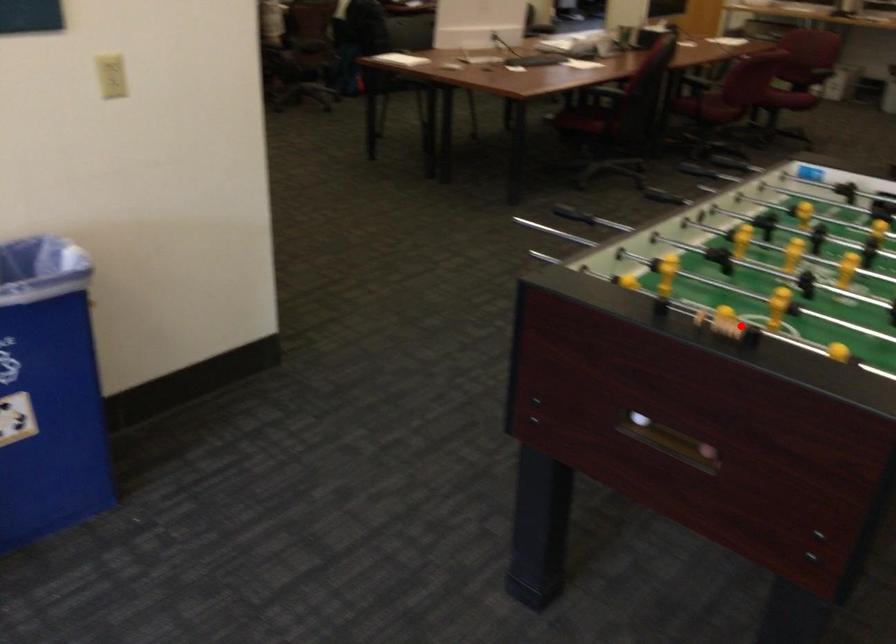
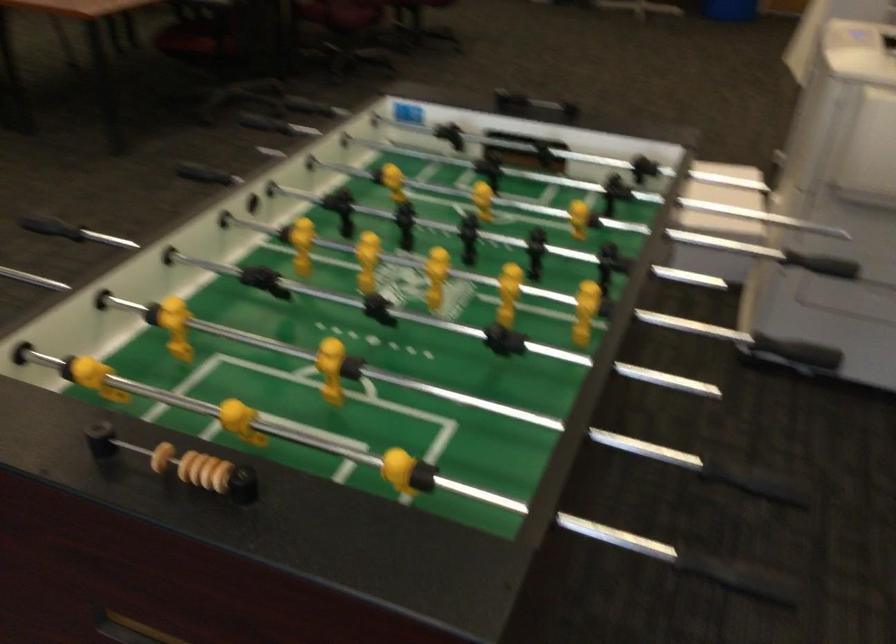
Question: I am providing you with two images of the same scene from different viewpoints. In image1, a red point is highlighted. Considering the same 3D point in image2, which of the following is correct?

Choices:
 (A) It is closer
 (B) It is farther

Answer: (A)